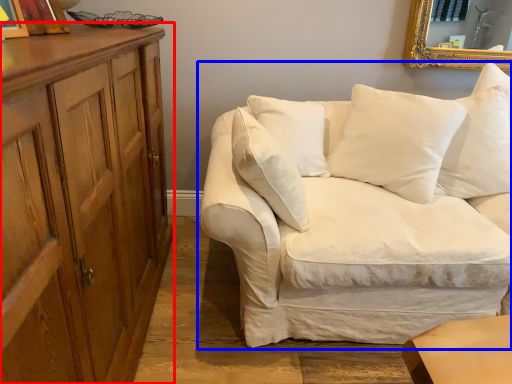
Question: Which object appears closest to the camera in this image, cabinetry (highlighted by a red box) or studio couch (highlighted by a blue box)?

Choices:
 (A) cabinetry
 (B) studio couch

Answer: (A)